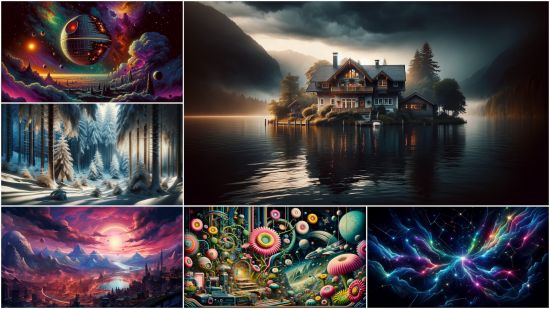
The height and width of the screenshot is (309, 550). Find the location of `lit window`. lit window is located at coordinates (351, 72), (384, 85).